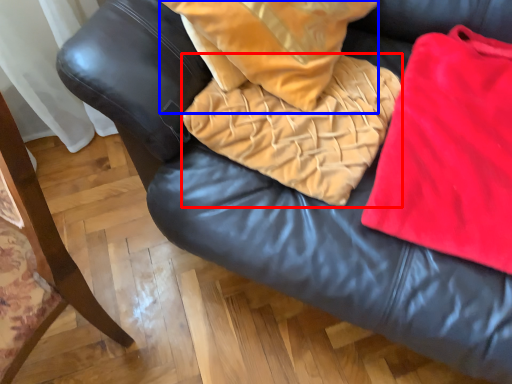
Question: Among these objects, which one is nearest to the camera, blanket (highlighted by a red box) or throw pillow (highlighted by a blue box)?

Choices:
 (A) blanket
 (B) throw pillow

Answer: (B)